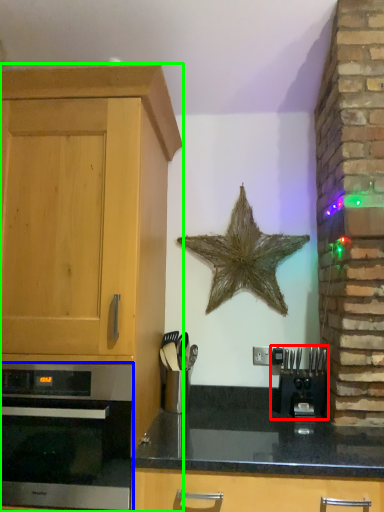
Question: Which object is positioned closest to coffee machine (highlighted by a red box)? Select from oven (highlighted by a blue box) and cabinetry (highlighted by a green box).

Choices:
 (A) oven
 (B) cabinetry

Answer: (A)